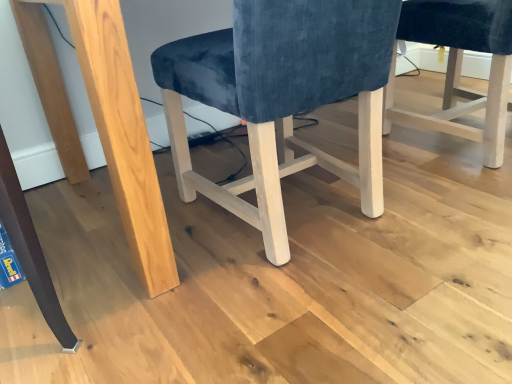
Question: Should I look upward or downward to see velvet blue chair at center, which is the 1th chair from left to right?

Choices:
 (A) down
 (B) up

Answer: (B)

Question: Is velvet blue chair at center, the 2th chair viewed from the left, not within velvet blue chair at center, which is the 1th chair from left to right?

Choices:
 (A) no
 (B) yes

Answer: (B)

Question: From the image's perspective, is velvet blue chair at center, which is the first chair in right-to-left order, over velvet blue chair at center, acting as the second chair starting from the right?

Choices:
 (A) yes
 (B) no

Answer: (A)

Question: From a real-world perspective, is velvet blue chair at center, which is the first chair in right-to-left order, positioned over velvet blue chair at center, which is the 1th chair from left to right, based on gravity?

Choices:
 (A) no
 (B) yes

Answer: (A)

Question: Is velvet blue chair at center, which is the first chair in right-to-left order, shorter than velvet blue chair at center, which is the 1th chair from left to right?

Choices:
 (A) no
 (B) yes

Answer: (B)

Question: Does velvet blue chair at center, which is the first chair in right-to-left order, turn towards velvet blue chair at center, which is the 1th chair from left to right?

Choices:
 (A) no
 (B) yes

Answer: (A)

Question: Does velvet blue chair at center, the 2th chair viewed from the left, contain velvet blue chair at center, acting as the second chair starting from the right?

Choices:
 (A) no
 (B) yes

Answer: (A)

Question: From the image's perspective, is velvet blue chair at center, which is the 1th chair from left to right, above velvet blue chair at center, which is the first chair in right-to-left order?

Choices:
 (A) yes
 (B) no

Answer: (B)

Question: Does velvet blue chair at center, which is the 1th chair from left to right, turn towards velvet blue chair at center, which is the first chair in right-to-left order?

Choices:
 (A) yes
 (B) no

Answer: (B)

Question: Are velvet blue chair at center, which is the 1th chair from left to right, and velvet blue chair at center, the 2th chair viewed from the left, making contact?

Choices:
 (A) yes
 (B) no

Answer: (B)

Question: From the image's perspective, is velvet blue chair at center, acting as the second chair starting from the right, located beneath velvet blue chair at center, which is the first chair in right-to-left order?

Choices:
 (A) no
 (B) yes

Answer: (B)

Question: From a real-world perspective, does velvet blue chair at center, which is the 1th chair from left to right, sit lower than velvet blue chair at center, which is the first chair in right-to-left order?

Choices:
 (A) no
 (B) yes

Answer: (A)

Question: Is velvet blue chair at center, the 2th chair viewed from the left, at the back of velvet blue chair at center, which is the 1th chair from left to right?

Choices:
 (A) no
 (B) yes

Answer: (A)

Question: Based on their sizes in the image, would you say velvet blue chair at center, acting as the second chair starting from the right, is bigger or smaller than velvet blue chair at center, the 2th chair viewed from the left?

Choices:
 (A) big
 (B) small

Answer: (A)